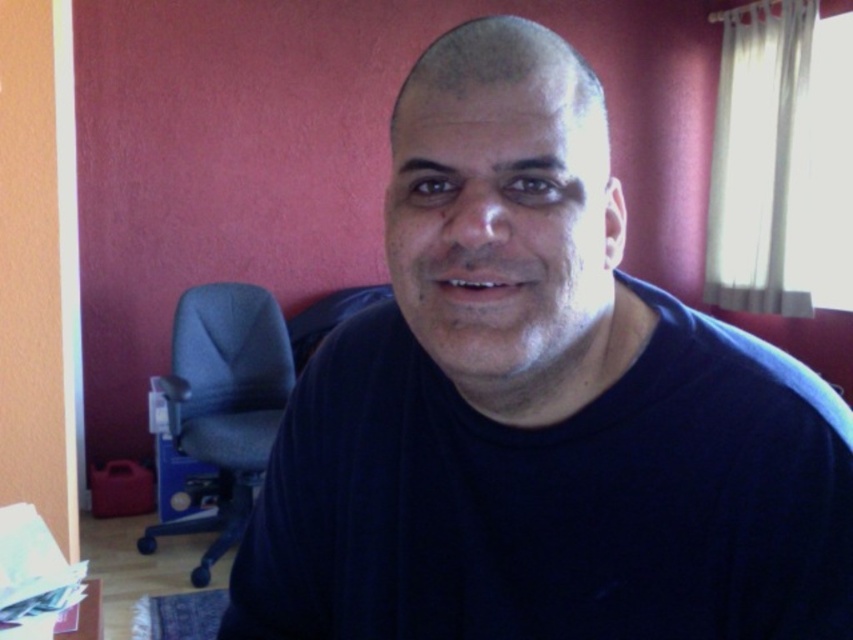
Question: Does dark blue t-shirt at center come behind dark gray fabric chair at left?

Choices:
 (A) no
 (B) yes

Answer: (A)

Question: Based on their relative distances, which object is nearer to the dark blue t-shirt at center?

Choices:
 (A) wooden table at lower left
 (B) dark gray fabric chair at left

Answer: (A)

Question: Can you confirm if dark gray fabric chair at left is positioned above wooden table at lower left?

Choices:
 (A) yes
 (B) no

Answer: (A)

Question: Which is farther from the dark gray fabric chair at left?

Choices:
 (A) dark blue t-shirt at center
 (B) wooden table at lower left

Answer: (A)

Question: Among these points, which one is nearest to the camera?

Choices:
 (A) (751, 586)
 (B) (231, 515)
 (C) (33, 630)

Answer: (A)

Question: Does dark blue t-shirt at center have a larger size compared to dark gray fabric chair at left?

Choices:
 (A) no
 (B) yes

Answer: (A)